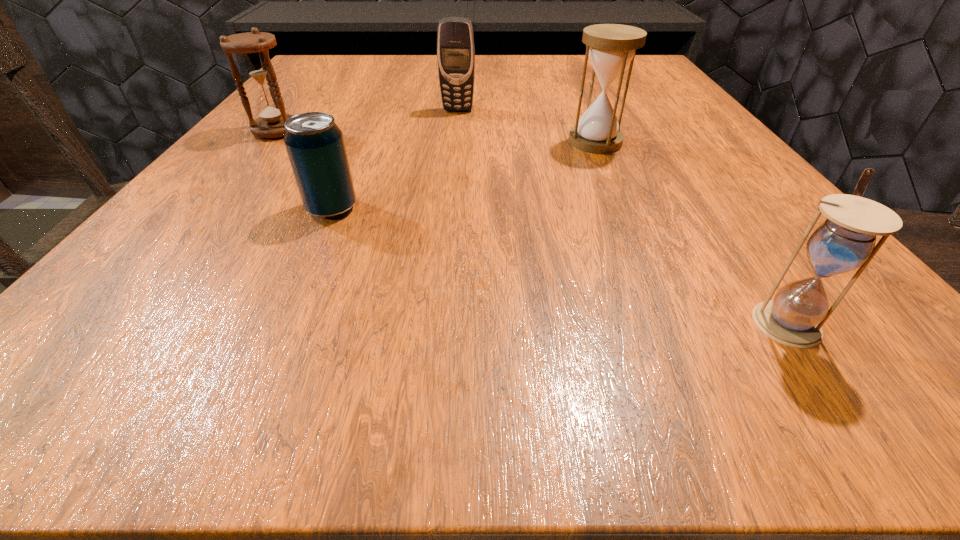
Where is `the second hourglass from right to left`? This screenshot has width=960, height=540. the second hourglass from right to left is located at coordinates (611, 47).

Image resolution: width=960 pixels, height=540 pixels. Identify the location of the farthest object. (455, 41).

This screenshot has height=540, width=960. I want to click on cellular telephone, so click(x=455, y=41).

The height and width of the screenshot is (540, 960). What are the coordinates of `the leftmost object` in the screenshot? It's located at (253, 47).

This screenshot has width=960, height=540. I want to click on the rightmost hourglass, so click(846, 240).

The width and height of the screenshot is (960, 540). I want to click on the nearest object, so click(x=846, y=240).

Locate an element on the screen. This screenshot has width=960, height=540. the shortest object is located at coordinates coord(315,145).

Find the location of a particular element. soda can is located at coordinates (x=315, y=145).

Where is `free space located on the left of the second object from right to left`? Image resolution: width=960 pixels, height=540 pixels. free space located on the left of the second object from right to left is located at coordinates (396, 142).

Locate an element on the screen. blank area located on the front face of the cellular telephone is located at coordinates (456, 126).